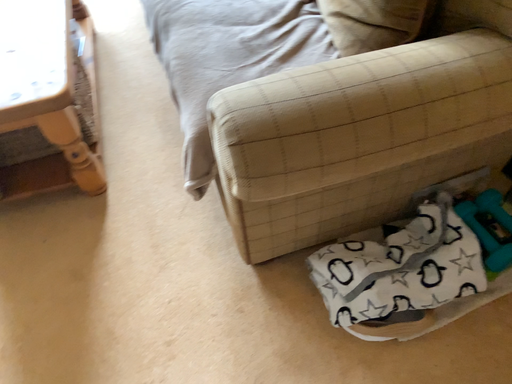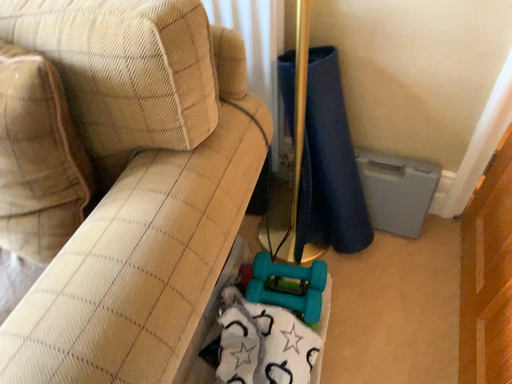
Question: Which way did the camera rotate in the video?

Choices:
 (A) rotated downward
 (B) rotated upward

Answer: (B)